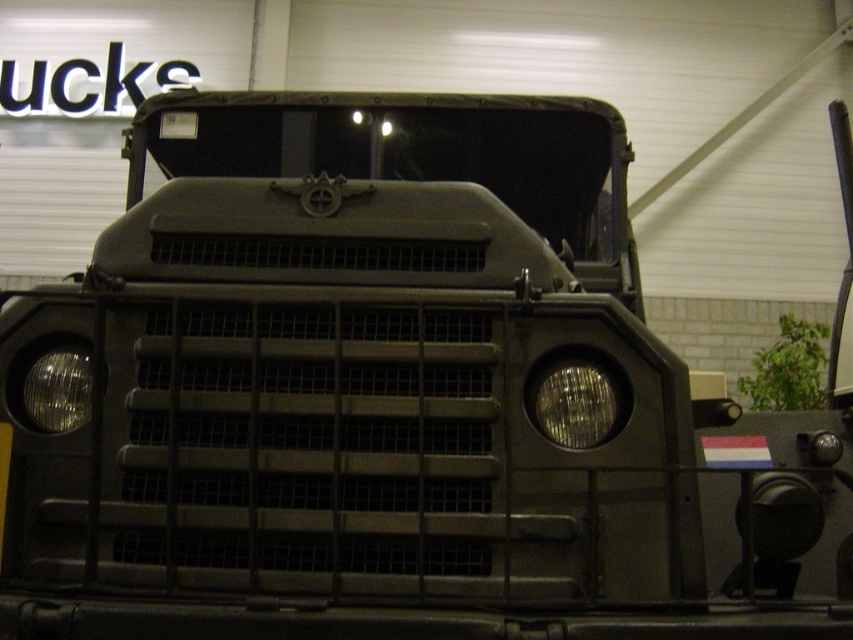
Does matte black headlight at right come in front of clear glass headlight at center?

Yes, it is in front of clear glass headlight at center.

Who is positioned more to the right, matte black headlight at right or clear glass headlight at center?

matte black headlight at right

Locate an element on the screen. The image size is (853, 640). matte black headlight at right is located at coordinates (575, 404).